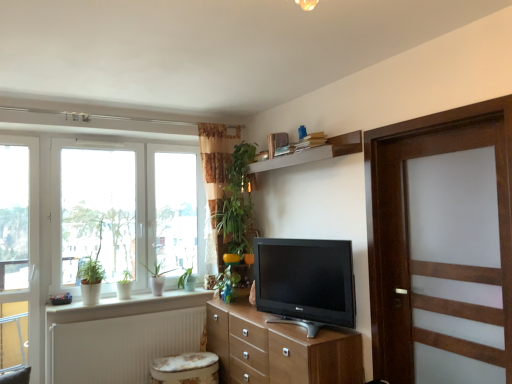
Question: From their relative heights in the image, would you say green glossy plant at left, arranged as the first plant when viewed from the left, is taller or shorter than transparent glass door at left?

Choices:
 (A) tall
 (B) short

Answer: (B)

Question: Considering the positions of green glossy plant at left, which ranks as the 2th plant in right-to-left order, and transparent glass door at left in the image, is green glossy plant at left, which ranks as the 2th plant in right-to-left order, wider or thinner than transparent glass door at left?

Choices:
 (A) thin
 (B) wide

Answer: (B)

Question: Estimate the real-world distances between objects in this image. Which object is farther from the green glossy plant at center, the first plant positioned from the right?

Choices:
 (A) wooden shelf at upper center
 (B) matte black tv at center
 (C) floral fabric music stool at lower center
 (D) transparent glass door at left
 (E) white textured radiator at lower left

Answer: (D)

Question: Which is nearer to the white ceramic pots at lower left?

Choices:
 (A) floral fabric music stool at lower center
 (B) transparent glass door at left
 (C) green glossy plant at left, which ranks as the 2th plant in right-to-left order
 (D) matte black tv at center
 (E) green glossy plant at center, which is the 2th plant in left-to-right order

Answer: (C)